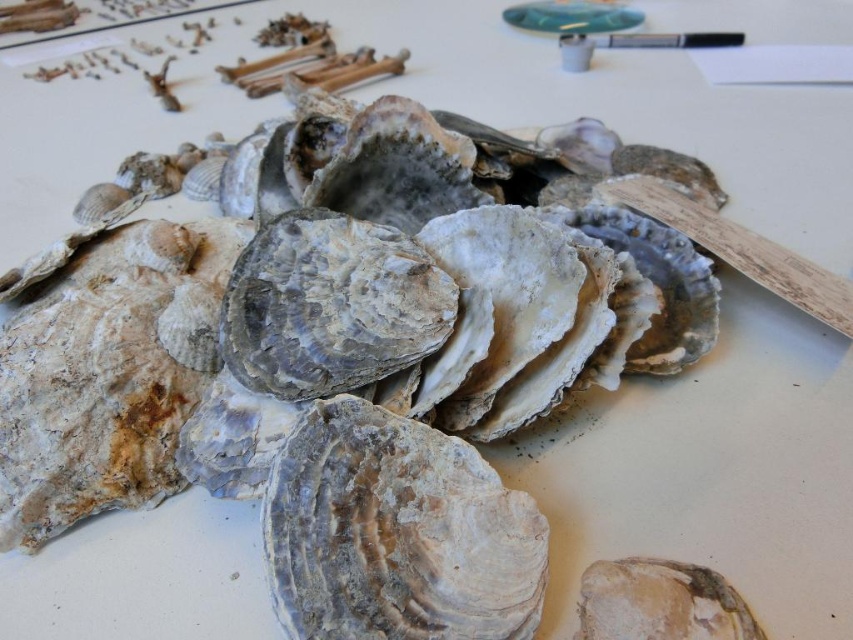
Consider the image. Is rough textured shell at center above gray textured shell at center?

Correct, rough textured shell at center is located above gray textured shell at center.

Which of these two, rough textured shell at center or gray textured shell at center, stands shorter?

Standing shorter between the two is gray textured shell at center.

Which is behind, point (335, 536) or point (271, 563)?

The point (335, 536) is more distant.

This screenshot has height=640, width=853. I want to click on rough textured shell at center, so click(x=335, y=376).

Who is higher up, gray textured shell at center or speckled stone shell at center?

gray textured shell at center is higher up.

Is point (466, 460) positioned after point (664, 586)?

Yes, point (466, 460) is farther from viewer.

Is point (486, 609) positioned before point (595, 596)?

Yes.

At what (x,y) coordinates should I click in order to perform the action: click on gray textured shell at center. Please return your answer as a coordinate pair (x, y). The image size is (853, 640). Looking at the image, I should click on (396, 532).

Which is in front, point (453, 308) or point (727, 632)?

Point (727, 632) is more forward.

Can you confirm if rough textured shell at center is positioned to the right of speckled stone shell at center?

In fact, rough textured shell at center is to the left of speckled stone shell at center.

Is point (399, 236) in front of point (685, 568)?

No.

Find the location of a particular element. The width and height of the screenshot is (853, 640). rough textured shell at center is located at coordinates (335, 376).